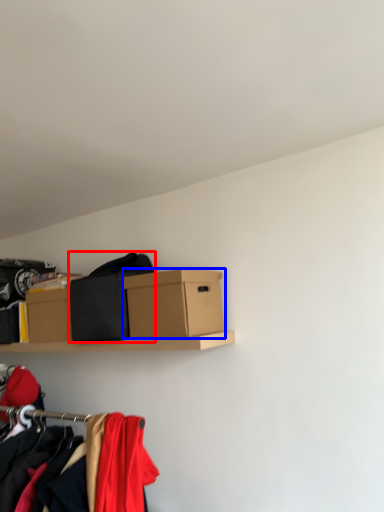
Question: Which object appears closest to the camera in this image, clothing (highlighted by a red box) or box (highlighted by a blue box)?

Choices:
 (A) clothing
 (B) box

Answer: (B)